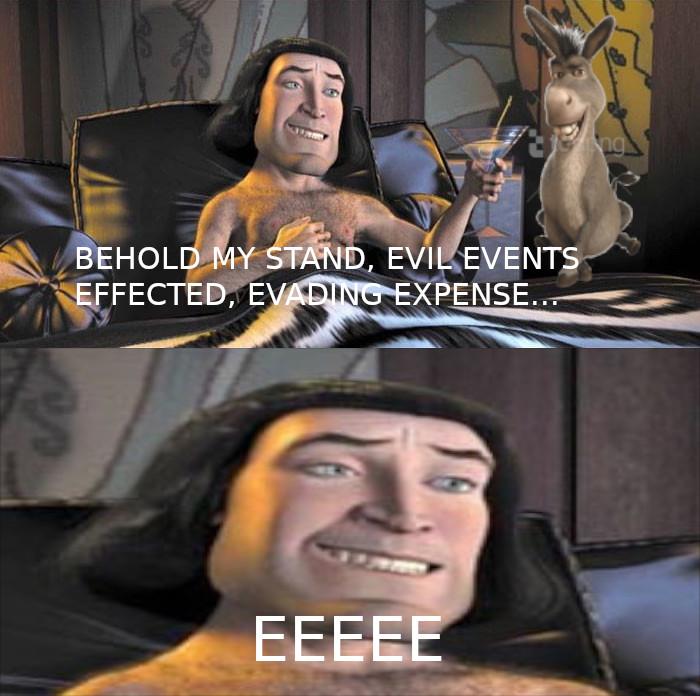
The width and height of the screenshot is (700, 696). I want to click on chest, so click(320, 205).